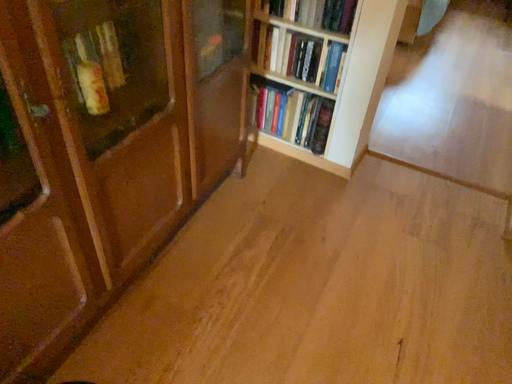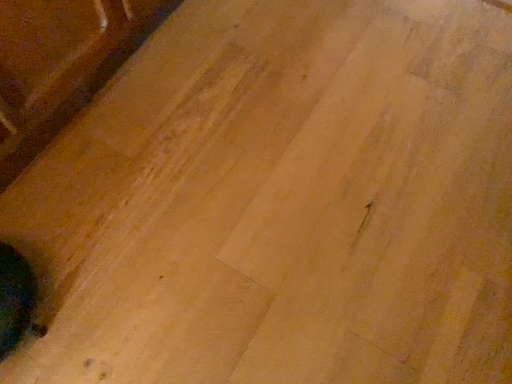
Question: Which way did the camera rotate in the video?

Choices:
 (A) rotated downward
 (B) rotated upward

Answer: (A)